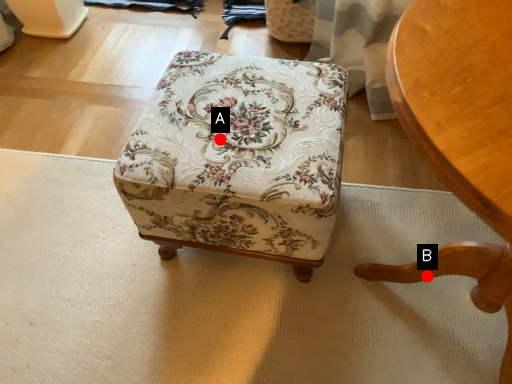
Question: Two points are circled on the image, labeled by A and B beside each circle. Which point is closer to the camera?

Choices:
 (A) A is closer
 (B) B is closer

Answer: (A)